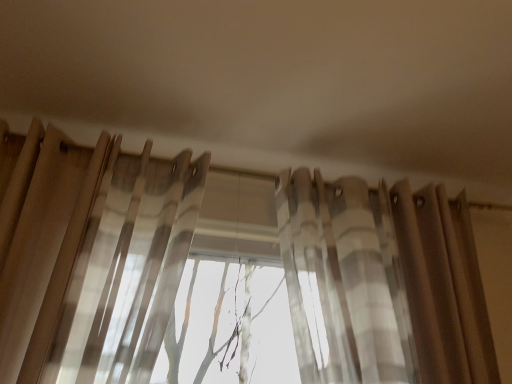
Find the location of a particular element. translucent fabric curtain at upper left is located at coordinates (90, 256).

The image size is (512, 384). Describe the element at coordinates (90, 256) in the screenshot. I see `translucent fabric curtain at upper left` at that location.

Where is `translucent fabric curtain at upper left`? This screenshot has height=384, width=512. translucent fabric curtain at upper left is located at coordinates (90, 256).